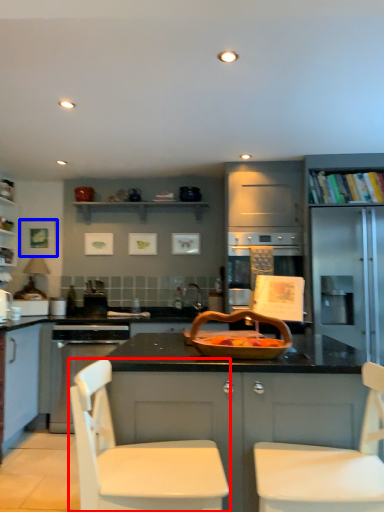
Question: Which point is further to the camera, chair (highlighted by a red box) or picture frame (highlighted by a blue box)?

Choices:
 (A) chair
 (B) picture frame

Answer: (B)